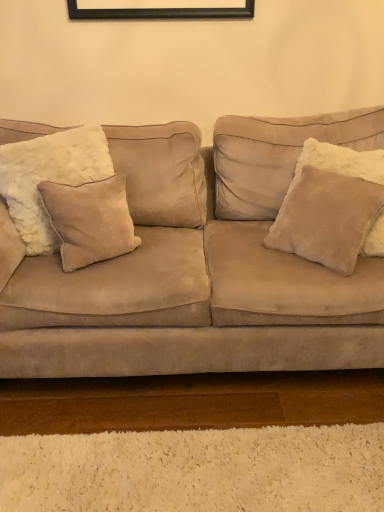
Where is `beige suede pillow at left, the 3th pillow viewed from the right`? This screenshot has height=512, width=384. beige suede pillow at left, the 3th pillow viewed from the right is located at coordinates (49, 178).

The image size is (384, 512). Describe the element at coordinates (90, 220) in the screenshot. I see `beige suede pillow at left, which is the second pillow in right-to-left order` at that location.

You are a GUI agent. You are given a task and a screenshot of the screen. Output one action in this format:
    pyautogui.click(x=<x>, y=<y>)
    Task: Click on the beige suede pillow at left, the 3th pillow viewed from the right
    This screenshot has height=512, width=384.
    Given the screenshot: What is the action you would take?
    pyautogui.click(x=49, y=178)

Is beige suede pillow at left, which is the second pillow in right-to-left order, not close to beige suede pillow at left, marked as the 1th pillow in a left-to-right arrangement?

No, beige suede pillow at left, which is the second pillow in right-to-left order, is in close proximity to beige suede pillow at left, marked as the 1th pillow in a left-to-right arrangement.

Measure the distance from beige suede pillow at left, which is the second pillow in right-to-left order, to beige suede pillow at left, marked as the 1th pillow in a left-to-right arrangement.

beige suede pillow at left, which is the second pillow in right-to-left order, and beige suede pillow at left, marked as the 1th pillow in a left-to-right arrangement, are 4.86 inches apart from each other.

Considering the relative positions of beige suede pillow at left, which is the second pillow in right-to-left order, and beige suede pillow at left, the 3th pillow viewed from the right, in the image provided, is beige suede pillow at left, which is the second pillow in right-to-left order, behind beige suede pillow at left, the 3th pillow viewed from the right,?

Yes, beige suede pillow at left, which is the second pillow in right-to-left order, is further from the camera.

Which of these two, beige suede pillow at left, which ranks as the second pillow in left-to-right order, or beige suede pillow at left, the 3th pillow viewed from the right, stands taller?

With more height is beige suede pillow at left, the 3th pillow viewed from the right.

In terms of height, does suede couch at center look taller or shorter compared to beige suede pillow at left, which ranks as the second pillow in left-to-right order?

Considering their sizes, suede couch at center has more height than beige suede pillow at left, which ranks as the second pillow in left-to-right order.

Based on the photo, from the image's perspective, is suede couch at center located above or below beige suede pillow at left, which is the second pillow in right-to-left order?

From the image's perspective, suede couch at center appears below beige suede pillow at left, which is the second pillow in right-to-left order.

Are suede couch at center and beige suede pillow at left, which ranks as the second pillow in left-to-right order, beside each other?

No.

From the image's perspective, is suede pillow at right, positioned as the 3th pillow in left-to-right order, on suede couch at center?

Correct, suede pillow at right, positioned as the 3th pillow in left-to-right order, appears higher than suede couch at center in the image.

In terms of width, does suede pillow at right, positioned as the 3th pillow in left-to-right order, look wider or thinner when compared to suede couch at center?

suede pillow at right, positioned as the 3th pillow in left-to-right order, is thinner than suede couch at center.

Is suede pillow at right, the 1th pillow in the right-to-left sequence, inside the boundaries of suede couch at center, or outside?

suede pillow at right, the 1th pillow in the right-to-left sequence, lies within the bounds of suede couch at center.

Between point (295, 237) and point (298, 280), which one is positioned behind?

The point (295, 237) is more distant.

In the image, is suede couch at center positioned in front of or behind suede pillow at right, the 1th pillow in the right-to-left sequence?

suede couch at center is positioned closer to the viewer than suede pillow at right, the 1th pillow in the right-to-left sequence.

Choose the correct answer: Is suede couch at center inside suede pillow at right, the 1th pillow in the right-to-left sequence, or outside it?

suede couch at center is spatially situated outside suede pillow at right, the 1th pillow in the right-to-left sequence.

Which of these two, suede couch at center or suede pillow at right, the 1th pillow in the right-to-left sequence, is smaller?

suede pillow at right, the 1th pillow in the right-to-left sequence, is smaller.

Can you confirm if suede couch at center is positioned to the left of suede pillow at right, positioned as the 3th pillow in left-to-right order?

Correct, you'll find suede couch at center to the left of suede pillow at right, positioned as the 3th pillow in left-to-right order.

Does beige suede pillow at left, marked as the 1th pillow in a left-to-right arrangement, have a larger size compared to suede pillow at right, positioned as the 3th pillow in left-to-right order?

Indeed, beige suede pillow at left, marked as the 1th pillow in a left-to-right arrangement, has a larger size compared to suede pillow at right, positioned as the 3th pillow in left-to-right order.

How different are the orientations of beige suede pillow at left, the 3th pillow viewed from the right, and suede pillow at right, the 1th pillow in the right-to-left sequence, in degrees?

77.7 degrees separate the facing orientations of beige suede pillow at left, the 3th pillow viewed from the right, and suede pillow at right, the 1th pillow in the right-to-left sequence.

How much distance is there between beige suede pillow at left, the 3th pillow viewed from the right, and suede pillow at right, the 1th pillow in the right-to-left sequence?

A distance of 36.05 inches exists between beige suede pillow at left, the 3th pillow viewed from the right, and suede pillow at right, the 1th pillow in the right-to-left sequence.

Considering the positions of point (108, 168) and point (351, 201), is point (108, 168) closer or farther from the camera than point (351, 201)?

Point (108, 168).

Is beige suede pillow at left, marked as the 1th pillow in a left-to-right arrangement, outside of suede couch at center?

No, beige suede pillow at left, marked as the 1th pillow in a left-to-right arrangement, is inside or overlapping with suede couch at center.

Is beige suede pillow at left, the 3th pillow viewed from the right, positioned with its back to suede couch at center?

Yes.

Between beige suede pillow at left, marked as the 1th pillow in a left-to-right arrangement, and suede couch at center, which one has smaller size?

Smaller between the two is beige suede pillow at left, marked as the 1th pillow in a left-to-right arrangement.

Is beige suede pillow at left, the 3th pillow viewed from the right, touching suede couch at center?

No, beige suede pillow at left, the 3th pillow viewed from the right, is not making contact with suede couch at center.

Considering the sizes of objects beige suede pillow at left, which ranks as the second pillow in left-to-right order, and suede couch at center in the image provided, who is smaller, beige suede pillow at left, which ranks as the second pillow in left-to-right order, or suede couch at center?

beige suede pillow at left, which ranks as the second pillow in left-to-right order.

Between beige suede pillow at left, which is the second pillow in right-to-left order, and suede couch at center, which one has less height?

With less height is beige suede pillow at left, which is the second pillow in right-to-left order.

From the image's perspective, who appears lower, beige suede pillow at left, which is the second pillow in right-to-left order, or suede couch at center?

suede couch at center, from the image's perspective.

From a real-world perspective, count 2nd pillows downward from the beige suede pillow at left, the 3th pillow viewed from the right, and point to it. Please provide its 2D coordinates.

[(90, 220)]

From a real-world perspective, which pillow is the 1st one above the suede couch at center? Please provide its 2D coordinates.

[(90, 220)]

When comparing their distances from suede couch at center, does beige suede pillow at left, the 3th pillow viewed from the right, or beige suede pillow at left, which is the second pillow in right-to-left order, seem further?

Based on the image, beige suede pillow at left, the 3th pillow viewed from the right, appears to be further to suede couch at center.

Looking at this image, estimate the real-world distances between objects in this image. Which object is closer to beige suede pillow at left, marked as the 1th pillow in a left-to-right arrangement, suede couch at center or beige suede pillow at left, which is the second pillow in right-to-left order?

beige suede pillow at left, which is the second pillow in right-to-left order, lies closer to beige suede pillow at left, marked as the 1th pillow in a left-to-right arrangement, than the other object.

Based on their spatial positions, is beige suede pillow at left, the 3th pillow viewed from the right, or suede couch at center further from beige suede pillow at left, which is the second pillow in right-to-left order?

suede couch at center is positioned further to the anchor beige suede pillow at left, which is the second pillow in right-to-left order.

From the image, which object appears to be farther from suede pillow at right, positioned as the 3th pillow in left-to-right order, suede couch at center or beige suede pillow at left, marked as the 1th pillow in a left-to-right arrangement?

The object further to suede pillow at right, positioned as the 3th pillow in left-to-right order, is beige suede pillow at left, marked as the 1th pillow in a left-to-right arrangement.

From the image, which object appears to be nearer to suede pillow at right, the 1th pillow in the right-to-left sequence, beige suede pillow at left, which ranks as the second pillow in left-to-right order, or suede couch at center?

Among the two, suede couch at center is located nearer to suede pillow at right, the 1th pillow in the right-to-left sequence.

Based on their spatial positions, is suede pillow at right, positioned as the 3th pillow in left-to-right order, or suede couch at center further from beige suede pillow at left, which ranks as the second pillow in left-to-right order?

suede pillow at right, positioned as the 3th pillow in left-to-right order, lies further to beige suede pillow at left, which ranks as the second pillow in left-to-right order, than the other object.

Looking at the image, which one is located closer to beige suede pillow at left, the 3th pillow viewed from the right, suede pillow at right, positioned as the 3th pillow in left-to-right order, or beige suede pillow at left, which ranks as the second pillow in left-to-right order?

Based on the image, beige suede pillow at left, which ranks as the second pillow in left-to-right order, appears to be nearer to beige suede pillow at left, the 3th pillow viewed from the right.

When comparing their distances from suede couch at center, does suede pillow at right, the 1th pillow in the right-to-left sequence, or beige suede pillow at left, which is the second pillow in right-to-left order, seem closer?

beige suede pillow at left, which is the second pillow in right-to-left order, is closer to suede couch at center.

Identify the location of studio couch between beige suede pillow at left, the 3th pillow viewed from the right, and suede pillow at right, the 1th pillow in the right-to-left sequence. (186, 287).

Locate an element on the screen. Image resolution: width=384 pixels, height=512 pixels. studio couch between beige suede pillow at left, which ranks as the second pillow in left-to-right order, and suede pillow at right, the 1th pillow in the right-to-left sequence, in the horizontal direction is located at coordinates (186, 287).

Image resolution: width=384 pixels, height=512 pixels. Find the location of `pillow between beige suede pillow at left, the 3th pillow viewed from the right, and suede pillow at right, positioned as the 3th pillow in left-to-right order`. pillow between beige suede pillow at left, the 3th pillow viewed from the right, and suede pillow at right, positioned as the 3th pillow in left-to-right order is located at coordinates (90, 220).

In order to click on pillow between beige suede pillow at left, the 3th pillow viewed from the right, and suede couch at center from left to right in this screenshot , I will do `click(90, 220)`.